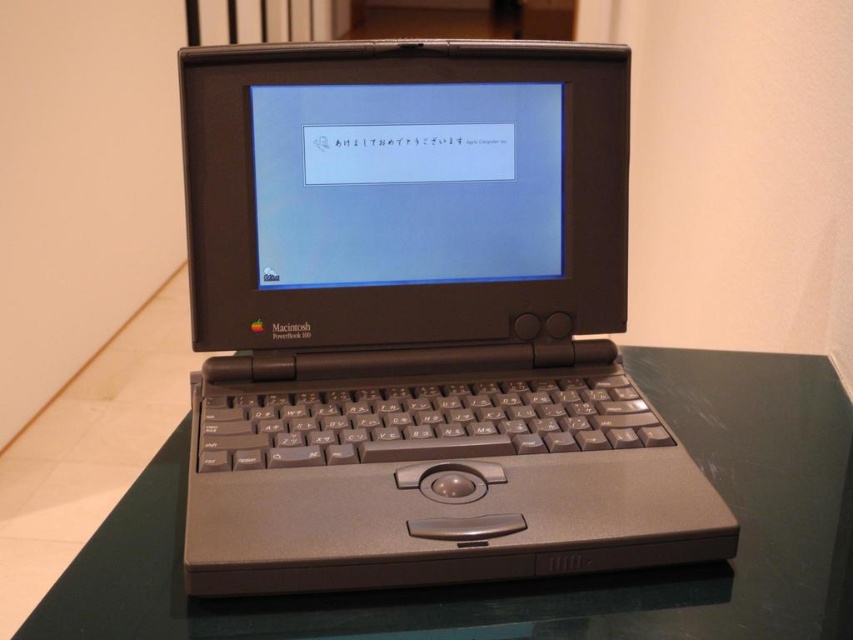
You have a small toy car that is 3 inches long. You want to roll it from the transparent glass table at center to the matte plastic screen at center. Is there enough space for the toy car to move between them?

The transparent glass table at center and matte plastic screen at center are 9.33 inches apart, so yes, the toy car which is 3 inches long can move between them since the distance is greater than the car length.

In the scene shown: You are a photographer setting up a shot of the vintage Apple Macintosh PowerBook 100. You need to place a small tripod at the point marked by the coordinates point (x=543, y=579). Based on the scene description, what surface will the tripod be placed on?

The point (x=543, y=579) indicates the transparent glass table at center, so the tripod will be placed on the transparent glass table at center.